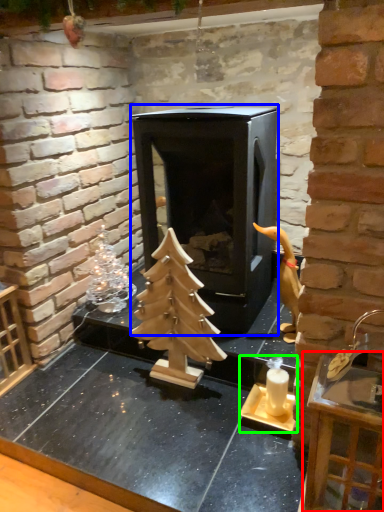
Question: Considering the real-world distances, which object is farthest from furniture (highlighted by a red box)? fireplace (highlighted by a blue box) or candle holder (highlighted by a green box)?

Choices:
 (A) fireplace
 (B) candle holder

Answer: (A)